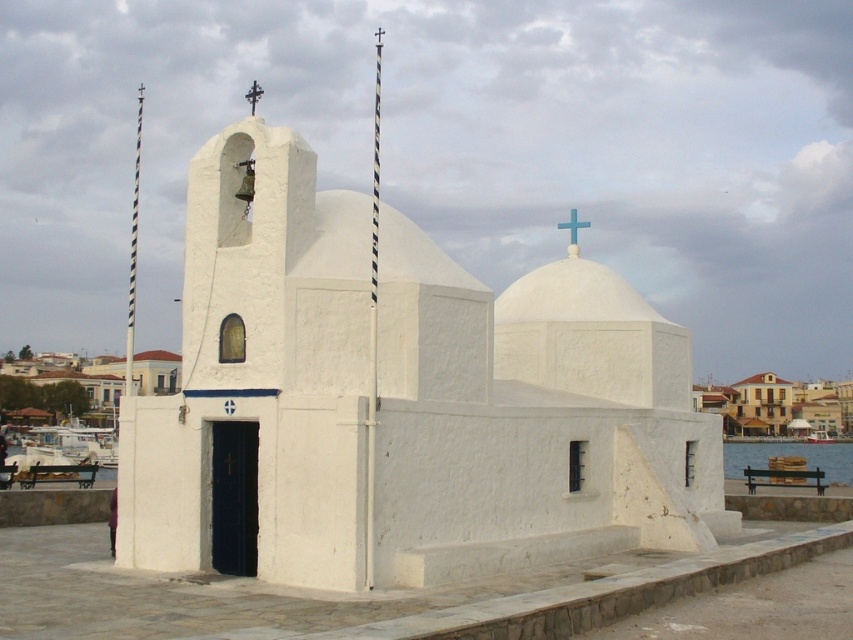
Is blue plastic cross at upper center smaller than metallic cross at upper center?

Indeed, blue plastic cross at upper center has a smaller size compared to metallic cross at upper center.

Where is `blue plastic cross at upper center`? blue plastic cross at upper center is located at coordinates (573, 232).

Is point (585, 221) less distant than point (248, 90)?

No, it is behind (248, 90).

Where is `blue plastic cross at upper center`? The width and height of the screenshot is (853, 640). blue plastic cross at upper center is located at coordinates (573, 232).

The width and height of the screenshot is (853, 640). I want to click on blue water at lower right, so click(790, 456).

Is blue water at lower right positioned behind blue plastic cross at upper center?

Yes, it is behind blue plastic cross at upper center.

Is point (828, 474) less distant than point (569, 230)?

That is False.

Locate an element on the screen. This screenshot has width=853, height=640. blue water at lower right is located at coordinates (790, 456).

Can you confirm if black and white striped pole at left is positioned below metallic cross at upper center?

Yes.

Is black and white striped pole at left to the right of metallic cross at upper center from the viewer's perspective?

In fact, black and white striped pole at left is to the left of metallic cross at upper center.

Locate an element on the screen. black and white striped pole at left is located at coordinates (132, 253).